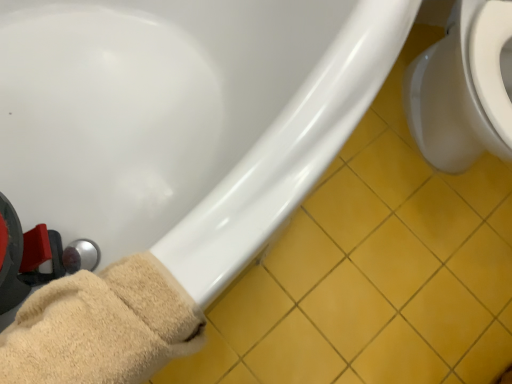
Where is `yellow tile at lower right`? yellow tile at lower right is located at coordinates (375, 270).

Measure the distance between point (110, 358) and camera.

The depth of point (110, 358) is 18.98 inches.

Find the location of `white glossy bathtub at lower left`. white glossy bathtub at lower left is located at coordinates (184, 119).

This screenshot has width=512, height=384. I want to click on yellow tile at lower right, so click(x=375, y=270).

From the image's perspective, does beige fuzzy towel at lower left appear higher than white glossy bathtub at lower left?

No, from the image's perspective, beige fuzzy towel at lower left is not on top of white glossy bathtub at lower left.

Which is more to the right, beige fuzzy towel at lower left or white glossy bathtub at lower left?

From the viewer's perspective, white glossy bathtub at lower left appears more on the right side.

Does point (29, 357) appear closer or farther from the camera than point (311, 87)?

Clearly, point (29, 357) is closer to the camera than point (311, 87).

Is beige fuzzy towel at lower left spatially inside white glossy bathtub at lower left, or outside of it?

beige fuzzy towel at lower left lies within the bounds of white glossy bathtub at lower left.

From a real-world perspective, is white glossy toilet at right physically located above or below beige fuzzy towel at lower left?

white glossy toilet at right is below beige fuzzy towel at lower left.

Is white glossy toilet at right facing towards beige fuzzy towel at lower left?

No, white glossy toilet at right is not aimed at beige fuzzy towel at lower left.

Is white glossy toilet at right not close to beige fuzzy towel at lower left?

No, white glossy toilet at right is in close proximity to beige fuzzy towel at lower left.

How many degrees apart are the facing directions of white glossy toilet at right and beige fuzzy towel at lower left?

The facing directions of white glossy toilet at right and beige fuzzy towel at lower left are 33.4 degrees apart.

Is yellow tile at lower right to the right of white glossy toilet at right from the viewer's perspective?

No, yellow tile at lower right is not to the right of white glossy toilet at right.

Who is smaller, yellow tile at lower right or white glossy toilet at right?

yellow tile at lower right is smaller.

You are a GUI agent. You are given a task and a screenshot of the screen. Output one action in this format:
    pyautogui.click(x=<x>, y=<y>)
    Task: Click on the tile that appears below the white glossy toilet at right (from the image's perspective)
    This screenshot has height=384, width=512.
    Given the screenshot: What is the action you would take?
    pyautogui.click(x=375, y=270)

Who is taller, yellow tile at lower right or white glossy toilet at right?

white glossy toilet at right is taller.

Is white glossy bathtub at lower left looking in the opposite direction of white glossy toilet at right?

No, white glossy bathtub at lower left is not facing the opposite direction of white glossy toilet at right.

In the scene shown: Would you say white glossy bathtub at lower left is outside white glossy toilet at right?

Absolutely, white glossy bathtub at lower left is external to white glossy toilet at right.

Does white glossy bathtub at lower left appear on the left side of white glossy toilet at right?

Correct, you'll find white glossy bathtub at lower left to the left of white glossy toilet at right.

Is white glossy bathtub at lower left not near white glossy toilet at right?

No, white glossy bathtub at lower left is in close proximity to white glossy toilet at right.

Locate an element on the screen. The image size is (512, 384). tile below the white glossy bathtub at lower left (from the image's perspective) is located at coordinates (375, 270).

Between white glossy bathtub at lower left and yellow tile at lower right, which one appears on the left side from the viewer's perspective?

white glossy bathtub at lower left.

From the image's perspective, relative to yellow tile at lower right, is white glossy bathtub at lower left above or below?

white glossy bathtub at lower left is situated higher than yellow tile at lower right in the image.

Can we say white glossy bathtub at lower left lies outside beige fuzzy towel at lower left?

Yes, white glossy bathtub at lower left is outside of beige fuzzy towel at lower left.

Considering the positions of point (3, 140) and point (122, 301), is point (3, 140) closer or farther from the camera than point (122, 301)?

Clearly, point (3, 140) is more distant from the camera than point (122, 301).

From the picture: From the image's perspective, which one is positioned higher, white glossy bathtub at lower left or beige fuzzy towel at lower left?

From the image's view, white glossy bathtub at lower left is above.

Is white glossy bathtub at lower left at the left side of beige fuzzy towel at lower left?

In fact, white glossy bathtub at lower left is to the right of beige fuzzy towel at lower left.

Visually, is beige fuzzy towel at lower left positioned to the left or to the right of white glossy toilet at right?

In the image, beige fuzzy towel at lower left appears on the left side of white glossy toilet at right.

Considering the sizes of objects beige fuzzy towel at lower left and white glossy toilet at right in the image provided, who is bigger, beige fuzzy towel at lower left or white glossy toilet at right?

white glossy toilet at right is bigger.

Which is behind, point (26, 301) or point (444, 159)?

The point (444, 159) is farther.

Considering the sizes of objects beige fuzzy towel at lower left and white glossy toilet at right in the image provided, who is shorter, beige fuzzy towel at lower left or white glossy toilet at right?

With less height is beige fuzzy towel at lower left.

In the image, there is a beige fuzzy towel at lower left. Identify the location of bathtub below it (from a real-world perspective). (184, 119).

Where is `toilet that appears on the right of beige fuzzy towel at lower left`? toilet that appears on the right of beige fuzzy towel at lower left is located at coordinates (462, 88).

Consider the image. Estimate the real-world distances between objects in this image. Which object is further from white glossy toilet at right, yellow tile at lower right or beige fuzzy towel at lower left?

beige fuzzy towel at lower left is positioned further to the anchor white glossy toilet at right.

Based on their spatial positions, is white glossy toilet at right or yellow tile at lower right further from beige fuzzy towel at lower left?

white glossy toilet at right is positioned further to the anchor beige fuzzy towel at lower left.

From the image, which object appears to be nearer to white glossy bathtub at lower left, yellow tile at lower right or beige fuzzy towel at lower left?

beige fuzzy towel at lower left is positioned closer to the anchor white glossy bathtub at lower left.

Based on their spatial positions, is yellow tile at lower right or white glossy toilet at right closer to white glossy bathtub at lower left?

yellow tile at lower right lies closer to white glossy bathtub at lower left than the other object.

Looking at the image, which one is located closer to yellow tile at lower right, white glossy bathtub at lower left or beige fuzzy towel at lower left?

white glossy bathtub at lower left lies closer to yellow tile at lower right than the other object.

From the image, which object appears to be nearer to white glossy bathtub at lower left, beige fuzzy towel at lower left or white glossy toilet at right?

beige fuzzy towel at lower left is positioned closer to the anchor white glossy bathtub at lower left.

Based on their spatial positions, is yellow tile at lower right or white glossy bathtub at lower left further from white glossy toilet at right?

white glossy bathtub at lower left lies further to white glossy toilet at right than the other object.

When comparing their distances from yellow tile at lower right, does white glossy toilet at right or beige fuzzy towel at lower left seem further?

The object further to yellow tile at lower right is beige fuzzy towel at lower left.

Where is `tile between white glossy bathtub at lower left and white glossy toilet at right in the horizontal direction`? The height and width of the screenshot is (384, 512). tile between white glossy bathtub at lower left and white glossy toilet at right in the horizontal direction is located at coordinates (375, 270).

What are the coordinates of `bathtub situated between beige fuzzy towel at lower left and white glossy toilet at right from left to right` in the screenshot? It's located at (184, 119).

Where is `towel between white glossy bathtub at lower left and yellow tile at lower right from front to back`? The image size is (512, 384). towel between white glossy bathtub at lower left and yellow tile at lower right from front to back is located at coordinates (102, 327).

Where is `tile situated between beige fuzzy towel at lower left and white glossy toilet at right from left to right`? This screenshot has height=384, width=512. tile situated between beige fuzzy towel at lower left and white glossy toilet at right from left to right is located at coordinates (375, 270).